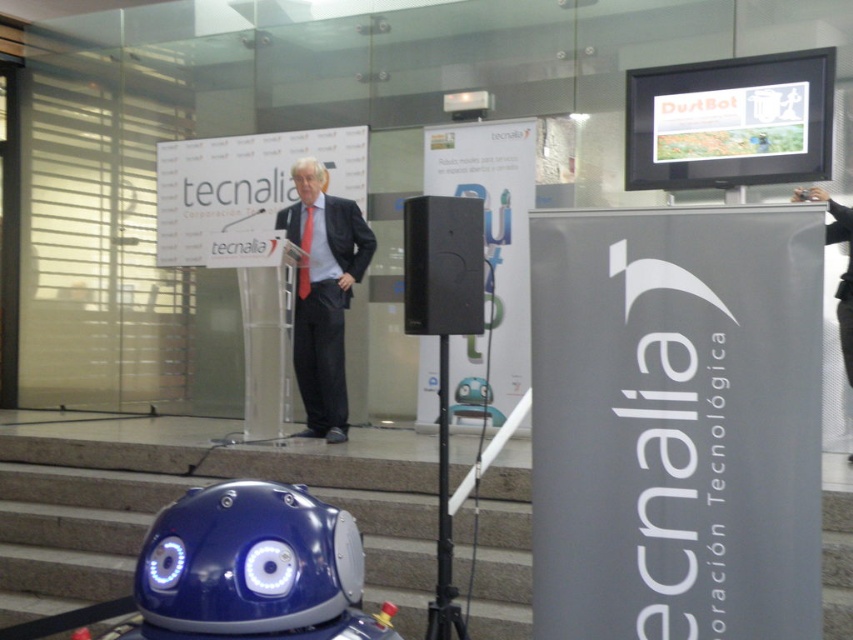
Who is more forward, (55, 497) or (314, 360)?

Point (55, 497)

Between smooth concrete stairs at lower center and matte black suit at center, which one has less height?

smooth concrete stairs at lower center is shorter.

Describe the element at coordinates (173, 499) in the screenshot. I see `smooth concrete stairs at lower center` at that location.

Identify the location of smooth concrete stairs at lower center. (173, 499).

Can you confirm if smooth concrete stairs at lower center is positioned to the left of black matte speaker at center?

Correct, you'll find smooth concrete stairs at lower center to the left of black matte speaker at center.

Measure the distance between point (393, 586) and camera.

Point (393, 586) is 13.35 feet from camera.

I want to click on smooth concrete stairs at lower center, so click(x=173, y=499).

Is the position of matte black suit at center less distant than that of dark gray suit at center?

No.

I want to click on matte black suit at center, so click(323, 294).